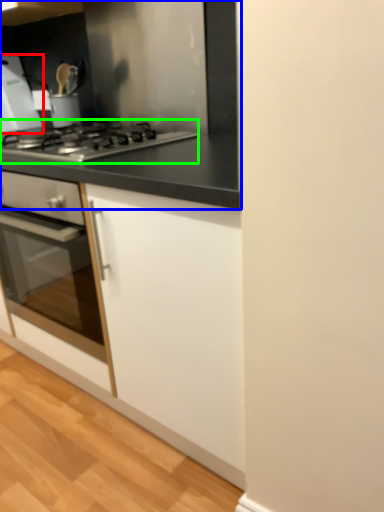
Question: Based on their relative distances, which object is nearer to home appliance (highlighted by a red box)? Choose from countertop (highlighted by a blue box) and gas stove (highlighted by a green box).

Choices:
 (A) countertop
 (B) gas stove

Answer: (A)